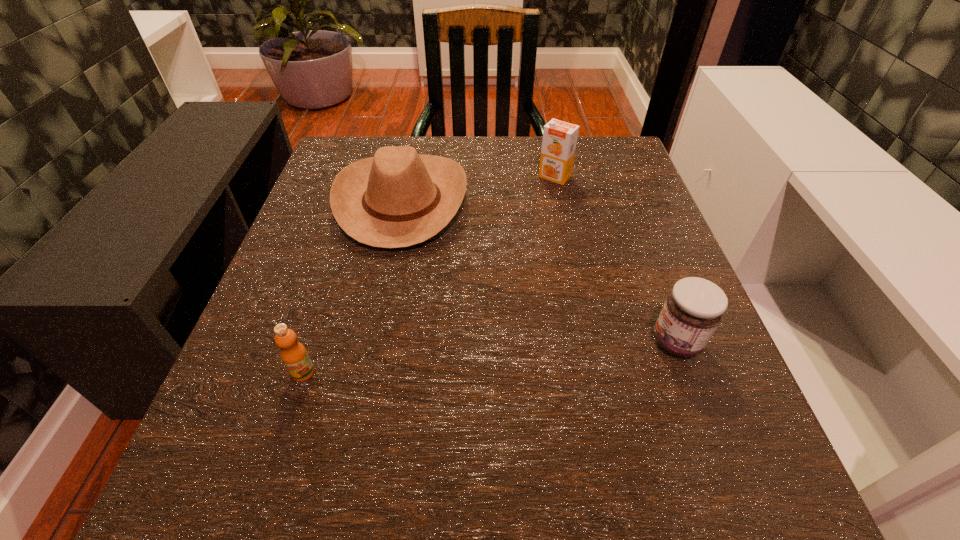
Locate an element on the screen. free space that satisfies the following two spatial constraints: 1. on the front-facing side of the cowboy hat; 2. on the front label of the nearer orange juice is located at coordinates (368, 373).

Locate an element on the screen. This screenshot has height=540, width=960. free space that satisfies the following two spatial constraints: 1. on the front label of the rightmost object; 2. on the front label of the shorter orange juice is located at coordinates (688, 373).

The width and height of the screenshot is (960, 540). Find the location of `free spot that satisfies the following two spatial constraints: 1. on the front label of the jam; 2. on the front label of the shorter orange juice`. free spot that satisfies the following two spatial constraints: 1. on the front label of the jam; 2. on the front label of the shorter orange juice is located at coordinates pyautogui.click(x=688, y=373).

Where is `free spot that satisfies the following two spatial constraints: 1. on the front-facing side of the cowboy hat; 2. on the front label of the shorter orange juice`? This screenshot has height=540, width=960. free spot that satisfies the following two spatial constraints: 1. on the front-facing side of the cowboy hat; 2. on the front label of the shorter orange juice is located at coordinates (368, 373).

What are the coordinates of `vacant area that satisfies the following two spatial constraints: 1. on the front label of the jam; 2. on the front label of the left orange juice` in the screenshot? It's located at (688, 373).

You are a GUI agent. You are given a task and a screenshot of the screen. Output one action in this format:
    pyautogui.click(x=<x>, y=<y>)
    Task: Click on the free space that satisfies the following two spatial constraints: 1. on the front label of the jam; 2. on the front label of the shorter orange juice
    Image resolution: width=960 pixels, height=540 pixels.
    Given the screenshot: What is the action you would take?
    pyautogui.click(x=688, y=373)